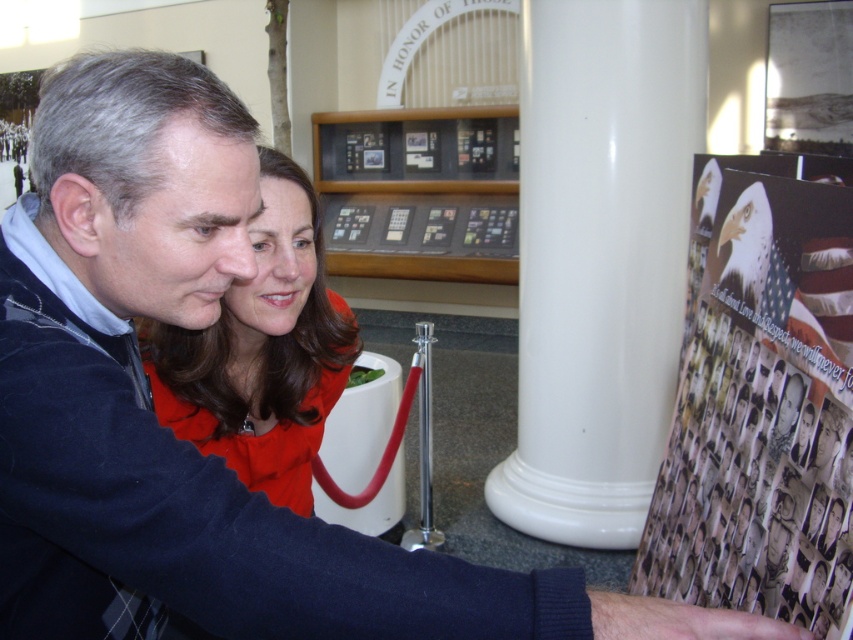
Does printed paper poster at right have a larger size compared to black glass display case at center?

No.

Can you confirm if printed paper poster at right is wider than black glass display case at center?

In fact, printed paper poster at right might be narrower than black glass display case at center.

The width and height of the screenshot is (853, 640). Identify the location of printed paper poster at right. point(761,401).

Identify the location of printed paper poster at right. This screenshot has width=853, height=640. (761, 401).

Who is positioned more to the right, matte red dress at center or black glass display case at center?

From the viewer's perspective, black glass display case at center appears more on the right side.

Between matte red dress at center and black glass display case at center, which one appears on the left side from the viewer's perspective?

From the viewer's perspective, matte red dress at center appears more on the left side.

Between point (196, 333) and point (500, 132), which one is positioned in front?

Positioned in front is point (196, 333).

Where is `matte red dress at center`? matte red dress at center is located at coordinates (262, 353).

Is point (762, 198) positioned behind point (270, 419)?

No, (762, 198) is closer to viewer.

Find the location of a particular element. printed paper poster at right is located at coordinates (761, 401).